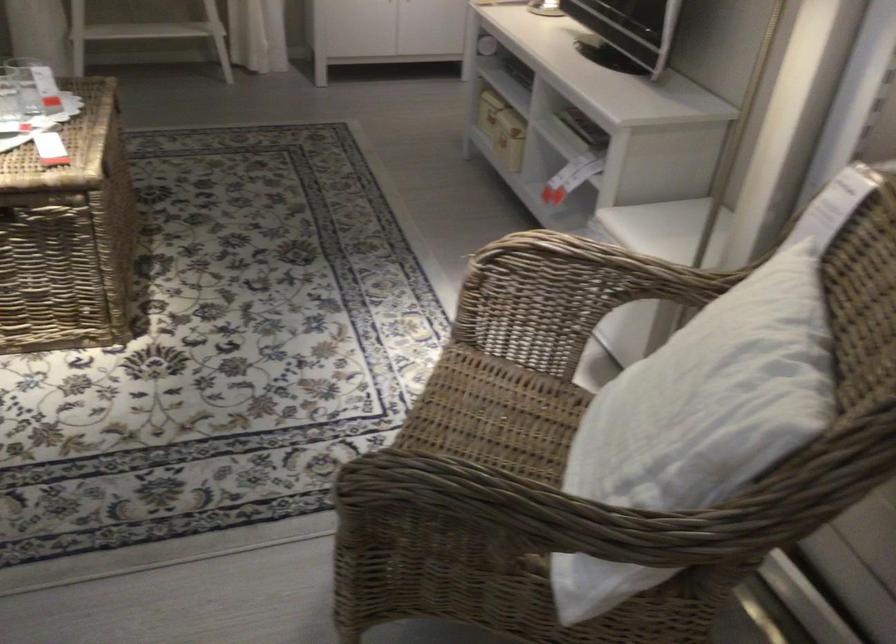
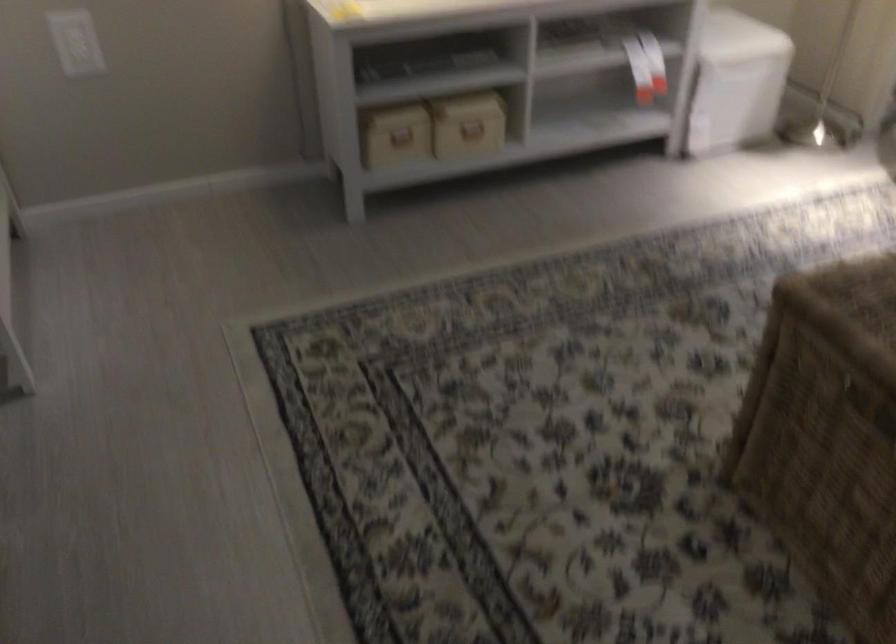
Find the pixel in the second image that matches pixel 497 137 in the first image.

(472, 131)